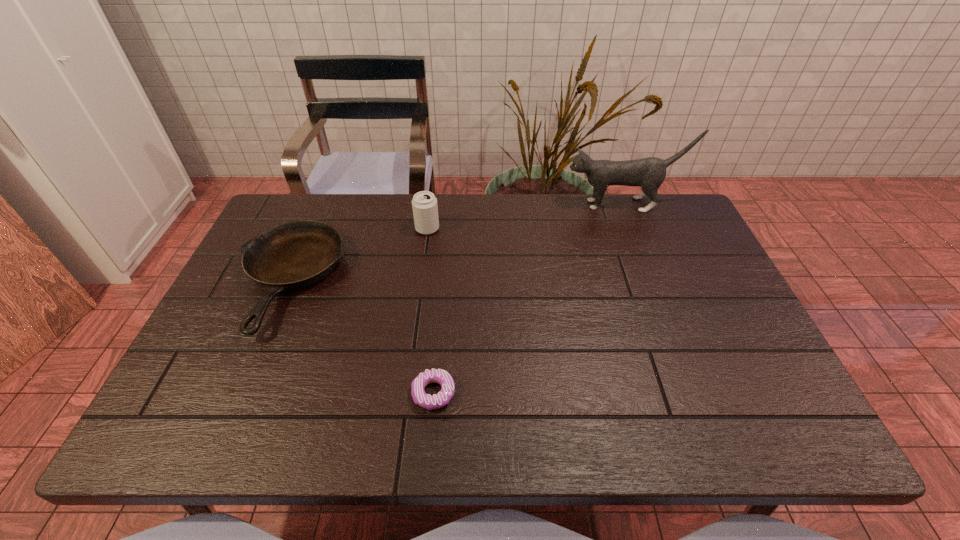
Where is `object located in the far right corner section of the desktop`? This screenshot has width=960, height=540. object located in the far right corner section of the desktop is located at coordinates (649, 173).

In the image, there is a desktop. Where is `free space at the far edge`? This screenshot has width=960, height=540. free space at the far edge is located at coordinates (478, 199).

Find the location of `vacant space at the near edge`. vacant space at the near edge is located at coordinates (708, 443).

Image resolution: width=960 pixels, height=540 pixels. In order to click on vacant space at the left edge of the desktop in this screenshot , I will do `click(198, 347)`.

Identify the location of blank area at the right edge. Image resolution: width=960 pixels, height=540 pixels. (708, 276).

You are a GUI agent. You are given a task and a screenshot of the screen. Output one action in this format:
    pyautogui.click(x=<x>, y=<y>)
    Task: Click on the blank space at the far left corner of the desktop
    The image size is (960, 540).
    Given the screenshot: What is the action you would take?
    pyautogui.click(x=323, y=216)

The image size is (960, 540). In the image, there is a desktop. What are the coordinates of `free space at the near right corner` in the screenshot? It's located at (723, 405).

Where is `vacant area that lies between the cat and the doughnut`? vacant area that lies between the cat and the doughnut is located at coordinates (528, 299).

This screenshot has height=540, width=960. What are the coordinates of `vacant area between the second shortest object and the nearest object` in the screenshot? It's located at (362, 338).

Identify the location of vacant space in between the third shortest object and the leftmost object. [x=359, y=255].